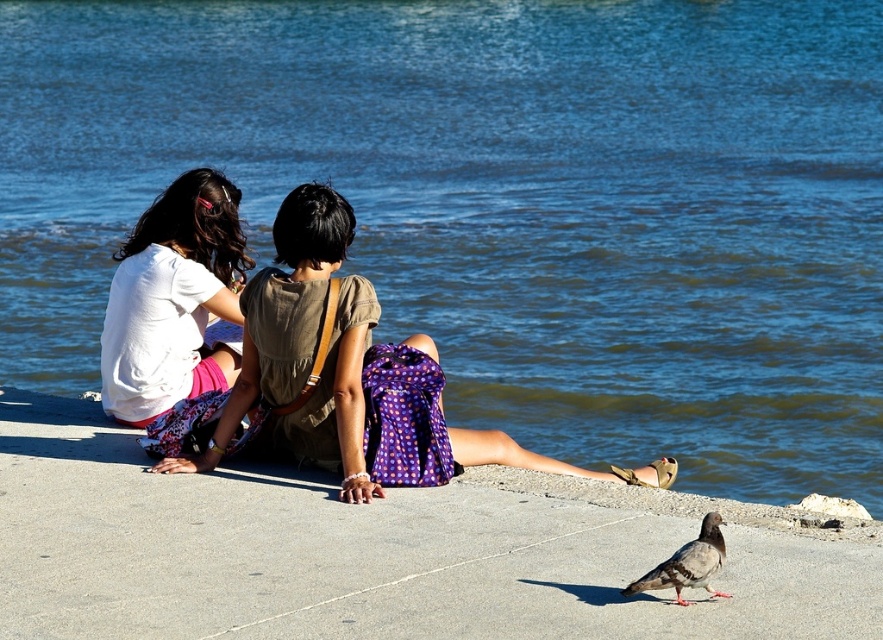
Can you confirm if white cotton shirt at center is thinner than white matte shirt at upper left?

No, white cotton shirt at center is not thinner than white matte shirt at upper left.

Describe the element at coordinates (344, 378) in the screenshot. Image resolution: width=883 pixels, height=640 pixels. I see `white cotton shirt at center` at that location.

Which is in front, point (431, 483) or point (229, 378)?

Positioned in front is point (431, 483).

The height and width of the screenshot is (640, 883). Find the location of `white cotton shirt at center`. white cotton shirt at center is located at coordinates (344, 378).

Does gray concrete at center have a larger size compared to gray matte pigeon at lower right?

Indeed, gray concrete at center has a larger size compared to gray matte pigeon at lower right.

From the picture: Does gray concrete at center have a smaller size compared to gray matte pigeon at lower right?

No, gray concrete at center is not smaller than gray matte pigeon at lower right.

At what (x,y) coordinates should I click in order to perform the action: click on gray concrete at center. Please return your answer as a coordinate pair (x, y). The height and width of the screenshot is (640, 883). Looking at the image, I should click on (372, 552).

Which is below, gray concrete at center or white cotton shirt at center?

gray concrete at center is below.

Is point (215, 630) more distant than point (458, 444)?

No, (215, 630) is closer to viewer.

This screenshot has width=883, height=640. I want to click on gray concrete at center, so click(372, 552).